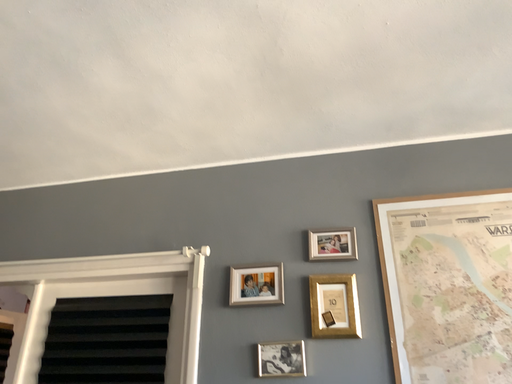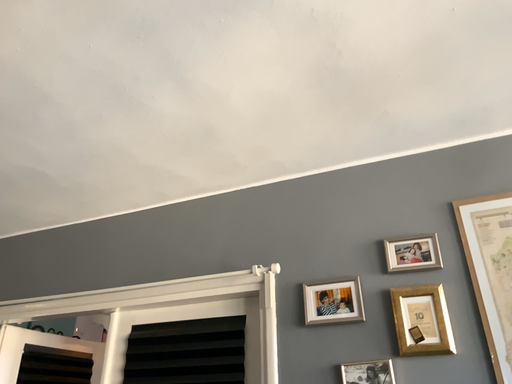
Question: How did the camera likely rotate when shooting the video?

Choices:
 (A) rotated right
 (B) rotated left

Answer: (B)